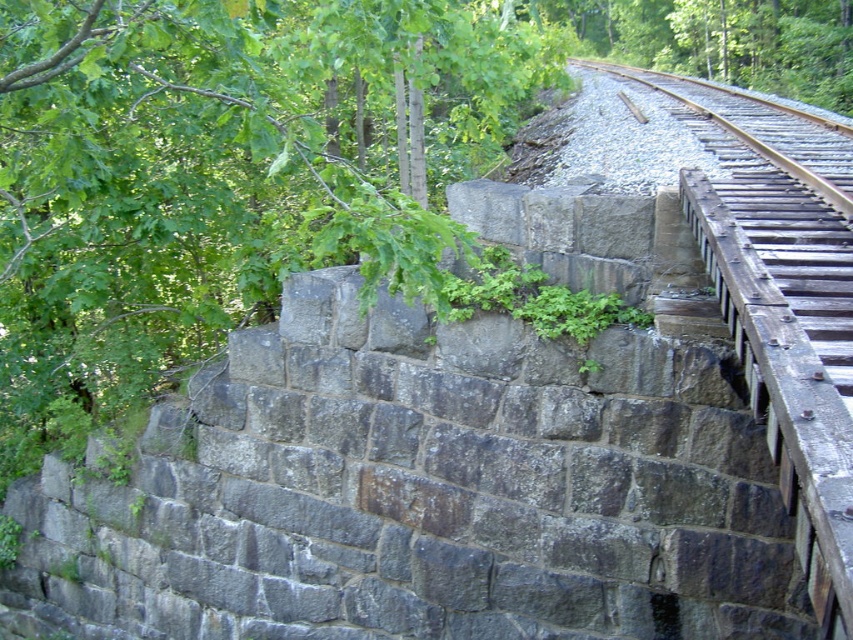
You are a bird flying over the railway bridge and want to land on the green leafy tree at upper left. What are the coordinates where you should aim to land?

The green leafy tree at upper left is located at coordinates (x=218, y=177), so you should aim for those coordinates to land on it.

You are standing on the railway bridge and looking towards the green leafy tree at upper left and the smooth brown wood at upper right. Which object is closer to you?

The green leafy tree at upper left is closer to you because it is in front of the smooth brown wood at upper right.

You are a painter standing on the railway bridge. You want to paint both the green leafy tree at upper left and the smooth brown wood at upper right. Which object should you focus on first if you want to paint the larger one first?

The green leafy tree at upper left is larger in size than the smooth brown wood at upper right, so you should focus on painting the green leafy tree at upper left first.